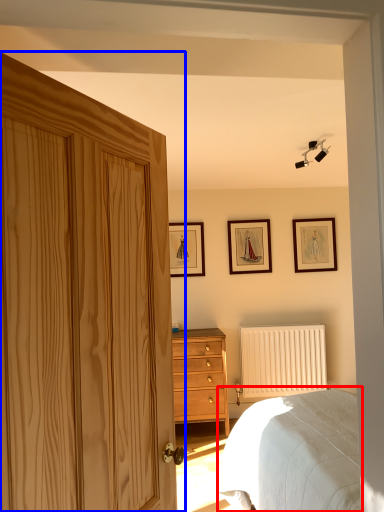
Question: Which object is closer to the camera taking this photo, bed (highlighted by a red box) or door (highlighted by a blue box)?

Choices:
 (A) bed
 (B) door

Answer: (B)